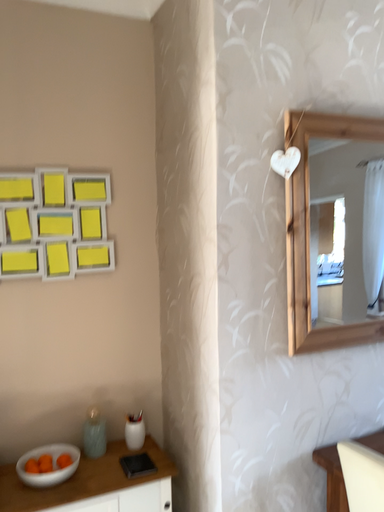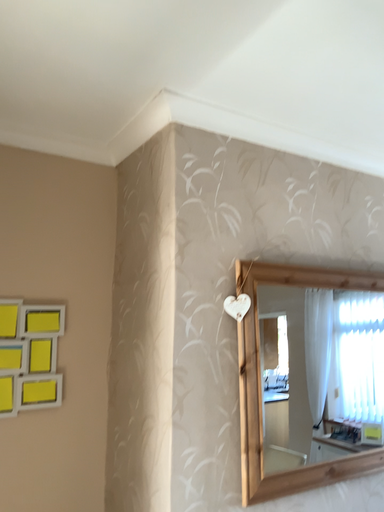
Question: Which way did the camera rotate in the video?

Choices:
 (A) rotated upward
 (B) rotated downward

Answer: (A)